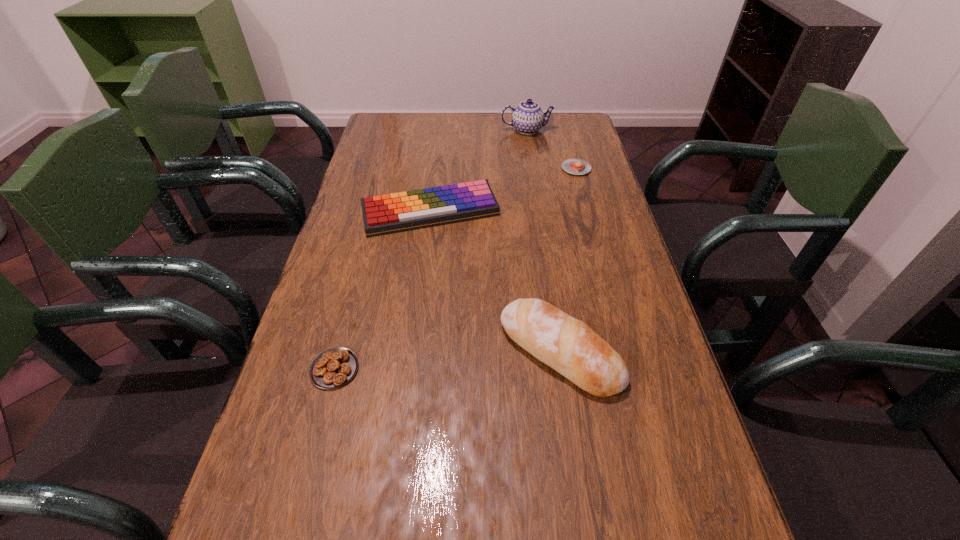
Identify the location of chinaware. This screenshot has width=960, height=540. (528, 117).

I want to click on the farthest object, so click(528, 117).

At what (x,y) coordinates should I click in order to perform the action: click on the second tallest object. Please return your answer as a coordinate pair (x, y). The image size is (960, 540). Looking at the image, I should click on (569, 346).

I want to click on computer keyboard, so click(384, 214).

Image resolution: width=960 pixels, height=540 pixels. Identify the location of the third nearest object. (384, 214).

The height and width of the screenshot is (540, 960). I want to click on the fourth nearest object, so click(573, 166).

At what (x,y) coordinates should I click in order to perform the action: click on the right pastry. Please return your answer as a coordinate pair (x, y). This screenshot has width=960, height=540. Looking at the image, I should click on (573, 166).

Identify the location of the nearer pastry. This screenshot has width=960, height=540. (332, 368).

Locate an element on the screen. This screenshot has width=960, height=540. vacant position located at the spout of the tallest object is located at coordinates (539, 207).

The width and height of the screenshot is (960, 540). I want to click on vacant space situated on the back of the bread, so click(x=541, y=229).